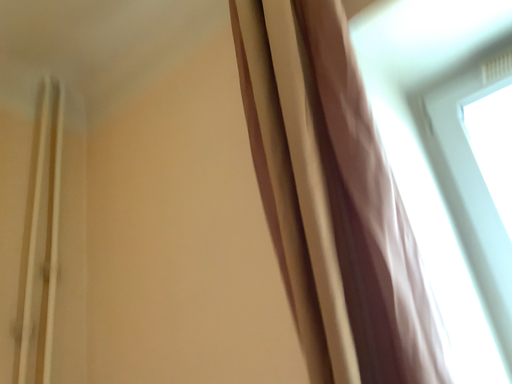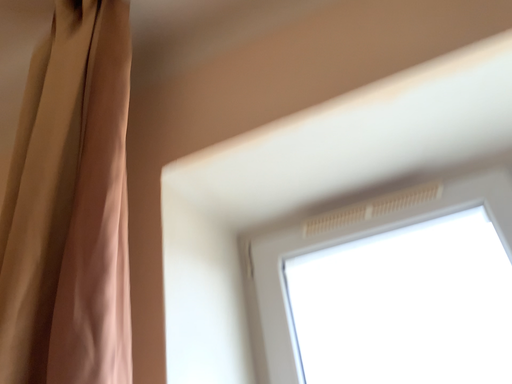
Question: How did the camera likely rotate when shooting the video?

Choices:
 (A) rotated left
 (B) rotated right

Answer: (B)